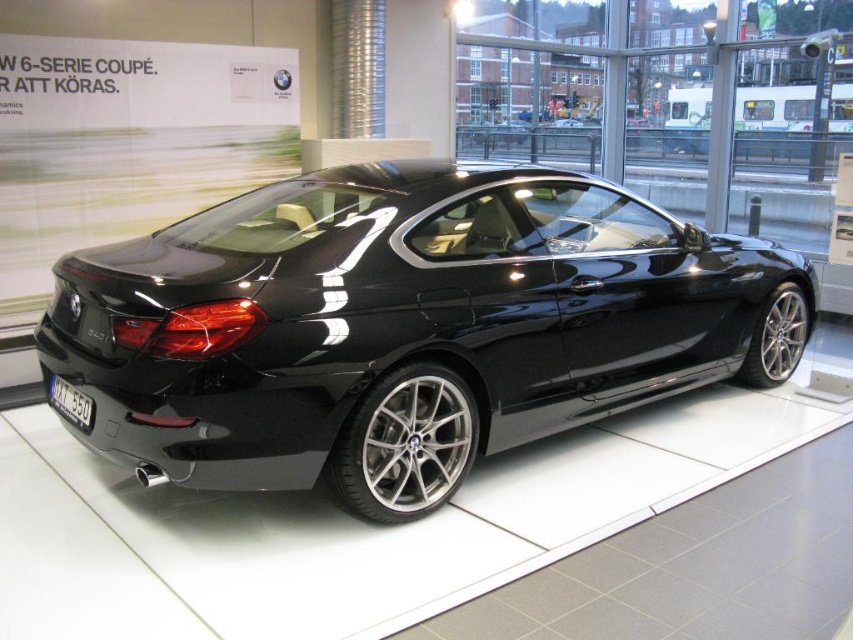
Question: Is glossy black car at center to the right of black plastic license plate at rear from the viewer's perspective?

Choices:
 (A) yes
 (B) no

Answer: (A)

Question: Which point is farther to the camera?

Choices:
 (A) pos(70,388)
 (B) pos(189,225)

Answer: (B)

Question: Is glossy black car at center further to camera compared to black plastic license plate at rear?

Choices:
 (A) no
 (B) yes

Answer: (A)

Question: Among these points, which one is farthest from the camera?

Choices:
 (A) (457, 316)
 (B) (54, 381)

Answer: (B)

Question: Is glossy black car at center below black plastic license plate at rear?

Choices:
 (A) no
 (B) yes

Answer: (A)

Question: Among these objects, which one is farthest from the camera?

Choices:
 (A) black plastic license plate at rear
 (B) glossy black car at center

Answer: (A)